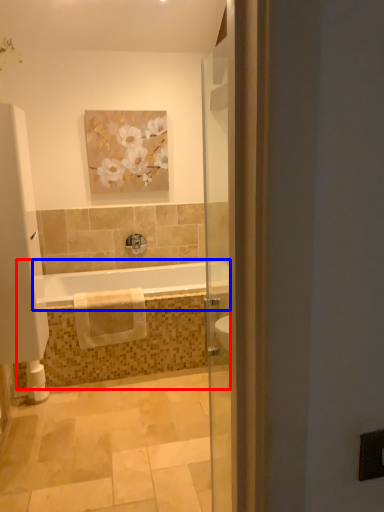
Question: Which object is further to the camera taking this photo, bath (highlighted by a red box) or bathtub (highlighted by a blue box)?

Choices:
 (A) bath
 (B) bathtub

Answer: (A)